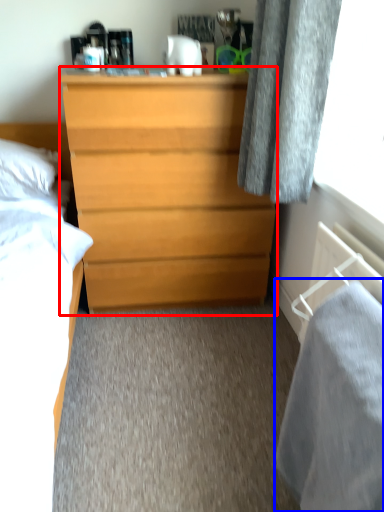
Question: Among these objects, which one is farthest to the camera, chest of drawers (highlighted by a red box) or sheet (highlighted by a blue box)?

Choices:
 (A) chest of drawers
 (B) sheet

Answer: (A)